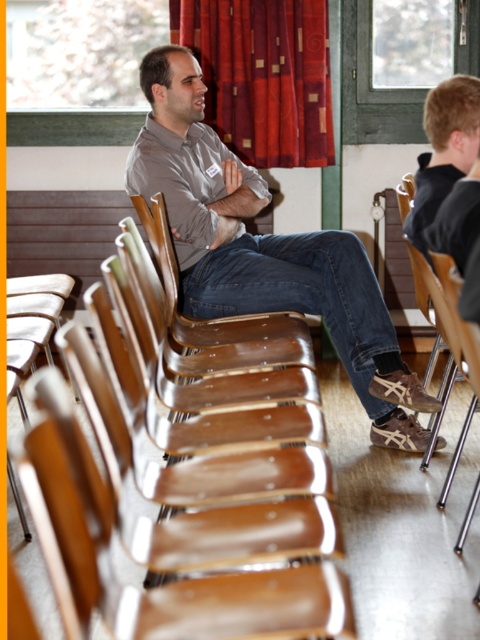
Question: Does brown leather shoes at center appear on the right side of black fabric shirt at right?

Choices:
 (A) no
 (B) yes

Answer: (A)

Question: Which point is closer to the camera?

Choices:
 (A) (428, 188)
 (B) (169, 188)
 (C) (285, 122)

Answer: (A)

Question: Does red velvet curtain at upper center appear over black fabric shirt at right?

Choices:
 (A) no
 (B) yes

Answer: (B)

Question: Is red velvet curtain at upper center bigger than black fabric shirt at right?

Choices:
 (A) yes
 (B) no

Answer: (A)

Question: Which of the following is the farthest from the observer?

Choices:
 (A) brown leather shoes at center
 (B) red velvet curtain at upper center

Answer: (B)

Question: Estimate the real-world distances between objects in this image. Which object is farther from the black fabric shirt at right?

Choices:
 (A) red velvet curtain at upper center
 (B) brown leather shoes at center

Answer: (A)